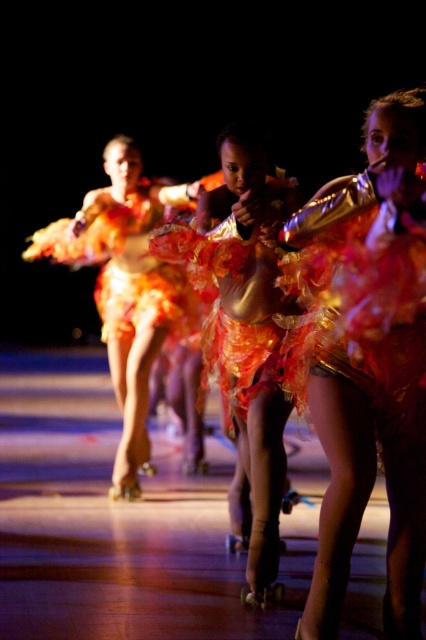
Can you confirm if shiny metallic skirt at center is positioned below shiny orange fabric dress at center?

Correct, shiny metallic skirt at center is located below shiny orange fabric dress at center.

Does shiny metallic skirt at center appear on the right side of shiny orange fabric dress at center?

Indeed, shiny metallic skirt at center is positioned on the right side of shiny orange fabric dress at center.

At what (x,y) coordinates should I click in order to perform the action: click on shiny metallic skirt at center. Please return your answer as a coordinate pair (x, y). This screenshot has height=640, width=426. Looking at the image, I should click on (367, 358).

Between shiny orange fabric skirt at center and shiny orange fabric at center, which one has less height?

With less height is shiny orange fabric skirt at center.

Consider the image. Is shiny orange fabric skirt at center positioned at the back of shiny orange fabric at center?

No, shiny orange fabric skirt at center is in front of shiny orange fabric at center.

Identify the location of shiny orange fabric skirt at center. The height and width of the screenshot is (640, 426). (253, 337).

You are a GUI agent. You are given a task and a screenshot of the screen. Output one action in this format:
    pyautogui.click(x=<x>, y=<y>)
    Task: Click on the shiny orange fabric skirt at center
    The image size is (426, 640).
    Given the screenshot: What is the action you would take?
    pyautogui.click(x=253, y=337)

How far apart are shiny orange fabric at center and shiny orange fabric dress at center?

The distance of shiny orange fabric at center from shiny orange fabric dress at center is 6.32 inches.

Can you confirm if shiny orange fabric at center is positioned to the left of shiny orange fabric dress at center?

Indeed, shiny orange fabric at center is positioned on the left side of shiny orange fabric dress at center.

Is point (146, 349) farther from viewer compared to point (141, 202)?

No, (146, 349) is closer to viewer.

Where is `shiny orange fabric at center`? The image size is (426, 640). shiny orange fabric at center is located at coordinates 124,288.